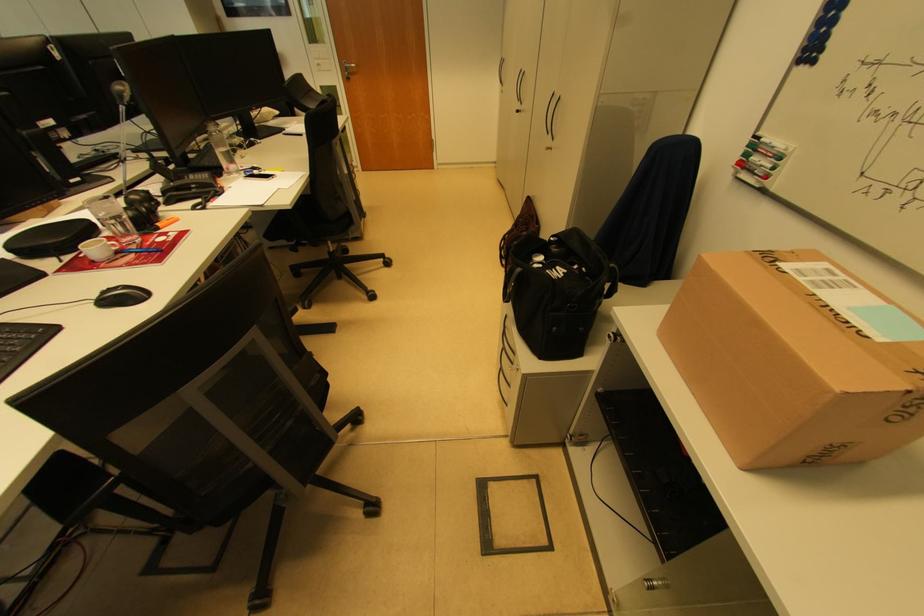
What do you see at coordinates (506, 342) in the screenshot? I see `a silver drawer handle` at bounding box center [506, 342].